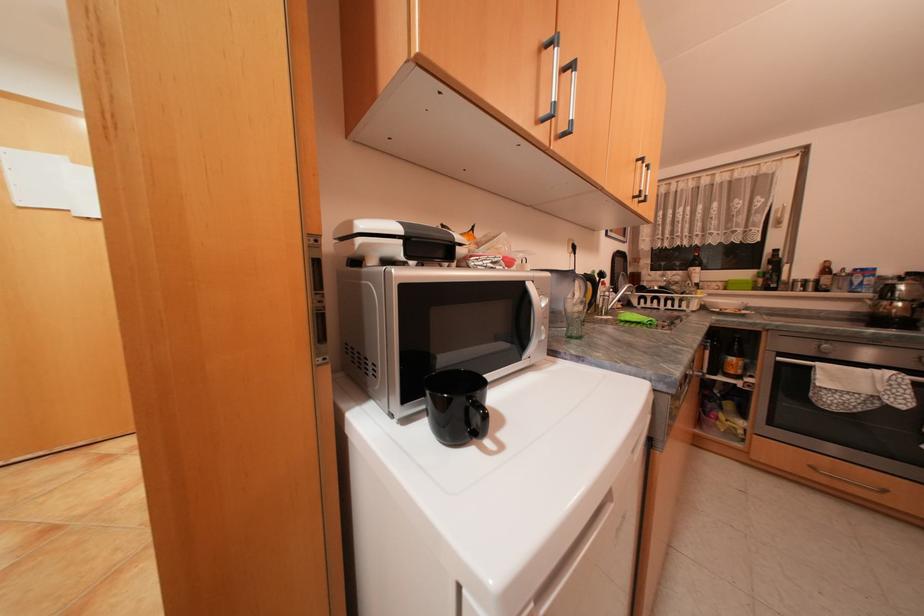
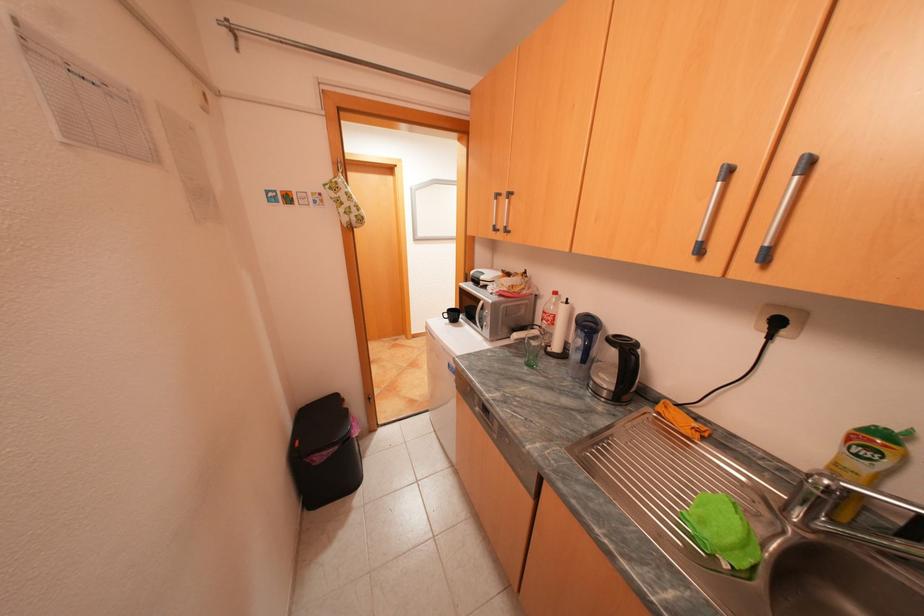
Locate, in the second image, the point that corresponds to [582,246] in the first image.

(786, 323)